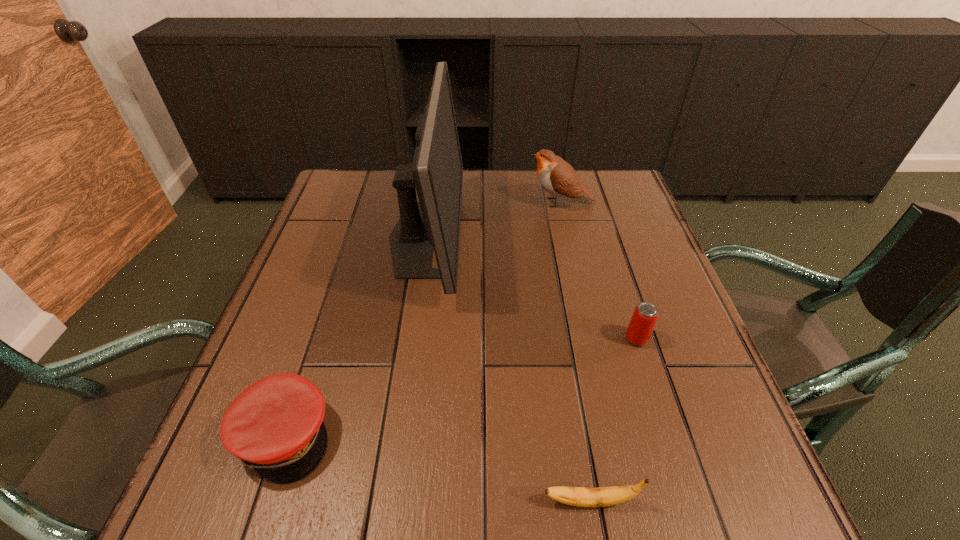
Find the location of a particular element. The image size is (960, 540). vacant area situated 0.320m at the face of the bird is located at coordinates (414, 202).

This screenshot has width=960, height=540. Find the location of `free spot located on the back of the beer can`. free spot located on the back of the beer can is located at coordinates (599, 222).

This screenshot has width=960, height=540. Identify the location of free region located 0.220m on the peel of the banana from the top. (398, 501).

Find the location of a particular element. free space located 0.310m on the peel of the banana from the top is located at coordinates (340, 501).

Where is `vacant area situated on the peel of the banana from the top`? The image size is (960, 540). vacant area situated on the peel of the banana from the top is located at coordinates (353, 501).

Image resolution: width=960 pixels, height=540 pixels. What are the coordinates of `vacant space situated 0.260m at the front of the cap where the visor is located` in the screenshot? It's located at (484, 436).

You are a GUI agent. You are given a task and a screenshot of the screen. Output one action in this format:
    pyautogui.click(x=<x>, y=<y>)
    Task: Click on the computer monitor that is at the far edge
    The image size is (960, 540).
    Given the screenshot: What is the action you would take?
    pyautogui.click(x=436, y=171)

In order to click on bird that is at the far edge in this screenshot , I will do `click(555, 175)`.

Image resolution: width=960 pixels, height=540 pixels. I want to click on banana that is at the near edge, so click(x=576, y=496).

What are the coordinates of `cap present at the near edge` in the screenshot? It's located at (275, 426).